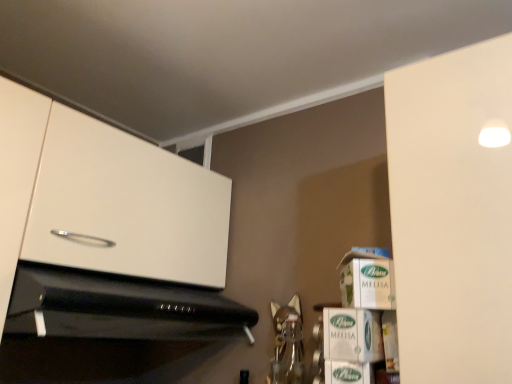
Question: From a real-world perspective, is green cardboard box at lower right, the 2th cardboard box positioned from the top, below green cardboard box at lower right, marked as the 1th cardboard box in a bottom-to-top arrangement?

Choices:
 (A) yes
 (B) no

Answer: (B)

Question: Is green cardboard box at lower right, the 2th cardboard box positioned from the top, further to camera compared to green cardboard box at lower right, arranged as the third cardboard box when viewed from the top?

Choices:
 (A) no
 (B) yes

Answer: (B)

Question: From the image's perspective, is green cardboard box at lower right, positioned as the 2th cardboard box in bottom-to-top order, above green cardboard box at lower right, marked as the 1th cardboard box in a bottom-to-top arrangement?

Choices:
 (A) yes
 (B) no

Answer: (A)

Question: Can you confirm if green cardboard box at lower right, the 2th cardboard box positioned from the top, is smaller than green cardboard box at lower right, arranged as the third cardboard box when viewed from the top?

Choices:
 (A) yes
 (B) no

Answer: (B)

Question: Is green cardboard box at lower right, the 2th cardboard box positioned from the top, wider than green cardboard box at lower right, marked as the 1th cardboard box in a bottom-to-top arrangement?

Choices:
 (A) no
 (B) yes

Answer: (B)

Question: Considering the positions of green cardboard box at lower right, arranged as the third cardboard box when viewed from the top, and black glossy microwave at lower left in the image, is green cardboard box at lower right, arranged as the third cardboard box when viewed from the top, wider or thinner than black glossy microwave at lower left?

Choices:
 (A) wide
 (B) thin

Answer: (B)

Question: Based on their sizes in the image, would you say green cardboard box at lower right, arranged as the third cardboard box when viewed from the top, is bigger or smaller than black glossy microwave at lower left?

Choices:
 (A) small
 (B) big

Answer: (A)

Question: Is green cardboard box at lower right, arranged as the third cardboard box when viewed from the top, in front of or behind black glossy microwave at lower left in the image?

Choices:
 (A) behind
 (B) front

Answer: (B)

Question: From the image's perspective, is green cardboard box at lower right, arranged as the third cardboard box when viewed from the top, positioned above or below black glossy microwave at lower left?

Choices:
 (A) below
 (B) above

Answer: (A)

Question: Considering the relative positions of green cardboard box at lower right, arranged as the third cardboard box when viewed from the top, and white glossy cabinet at upper left in the image provided, is green cardboard box at lower right, arranged as the third cardboard box when viewed from the top, to the left or to the right of white glossy cabinet at upper left?

Choices:
 (A) left
 (B) right

Answer: (B)

Question: In terms of height, does green cardboard box at lower right, marked as the 1th cardboard box in a bottom-to-top arrangement, look taller or shorter compared to white glossy cabinet at upper left?

Choices:
 (A) tall
 (B) short

Answer: (B)

Question: Is green cardboard box at lower right, marked as the 1th cardboard box in a bottom-to-top arrangement, inside the boundaries of white glossy cabinet at upper left, or outside?

Choices:
 (A) outside
 (B) inside

Answer: (A)

Question: From the image's perspective, relative to white glossy cabinet at upper left, is green cardboard box at lower right, arranged as the third cardboard box when viewed from the top, above or below?

Choices:
 (A) below
 (B) above

Answer: (A)

Question: Is white cardboard box at right, the third cardboard box positioned from the bottom, in front of or behind green cardboard box at lower right, marked as the 1th cardboard box in a bottom-to-top arrangement, in the image?

Choices:
 (A) behind
 (B) front

Answer: (A)

Question: Is point (374, 289) closer or farther from the camera than point (361, 374)?

Choices:
 (A) closer
 (B) farther

Answer: (B)